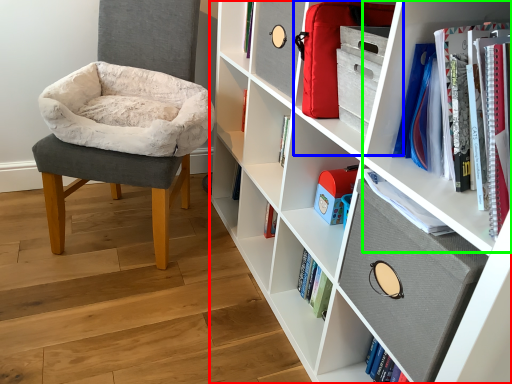
Question: Which is farther away from shelf (highlighted by a red box)? cabinet (highlighted by a blue box) or shelf (highlighted by a green box)?

Choices:
 (A) cabinet
 (B) shelf

Answer: (B)